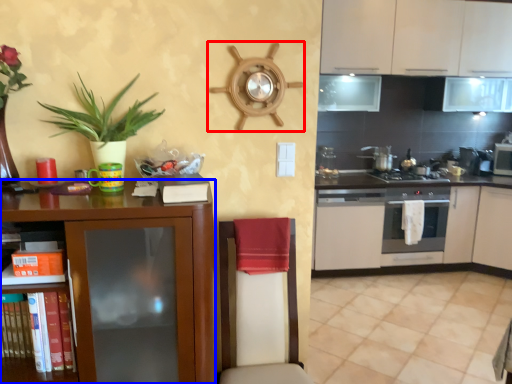
Question: Among these objects, which one is nearest to the camera, appliance (highlighted by a red box) or cabinetry (highlighted by a blue box)?

Choices:
 (A) appliance
 (B) cabinetry

Answer: (B)